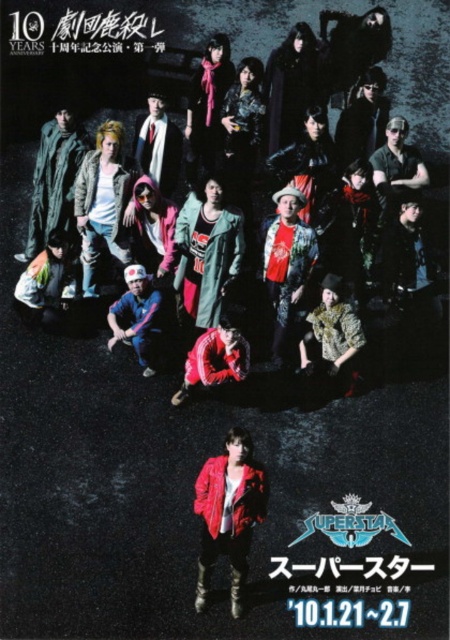
Who is positioned more to the left, shiny red leather jacket at center or green matte jacket at center?

From the viewer's perspective, green matte jacket at center appears more on the left side.

Can you confirm if shiny red leather jacket at center is smaller than green matte jacket at center?

Indeed, shiny red leather jacket at center has a smaller size compared to green matte jacket at center.

Between point (235, 433) and point (220, 284), which one is positioned in front?

Point (235, 433) is in front.

Locate an element on the screen. The height and width of the screenshot is (640, 450). shiny red leather jacket at center is located at coordinates (229, 515).

From the picture: Is green matte jacket at center shorter than denim jacket at center?

Indeed, green matte jacket at center has a lesser height compared to denim jacket at center.

Is point (176, 240) farther from camera compared to point (111, 216)?

No, (176, 240) is closer to viewer.

What are the coordinates of `green matte jacket at center` in the screenshot? It's located at (x=207, y=253).

Between fluffy fur coat at center and matte black shirt at upper right, which one is positioned higher?

matte black shirt at upper right

Who is more distant from viewer, (316, 353) or (383, 148)?

The point (383, 148) is more distant.

Identify the location of fluffy fur coat at center. (333, 332).